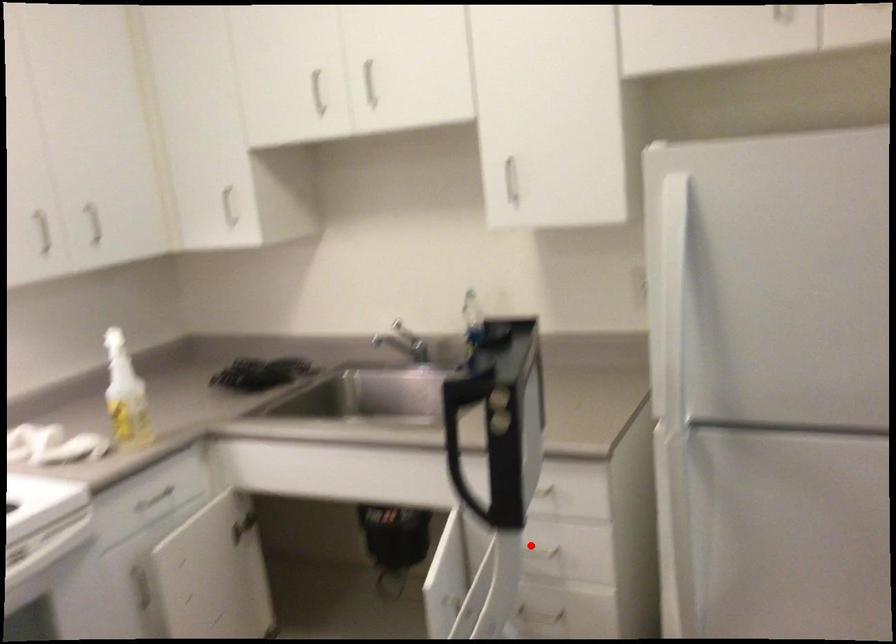
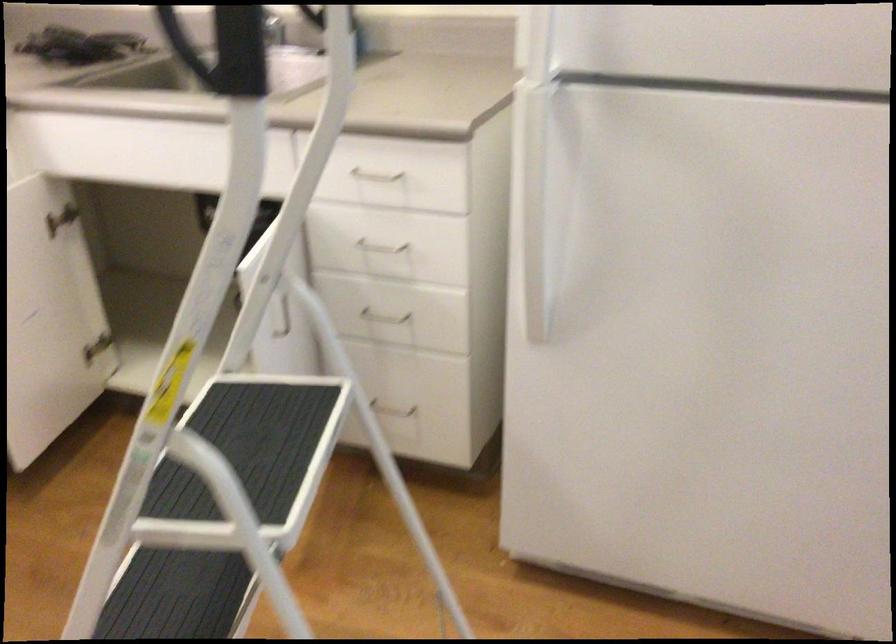
Question: A red point is marked in image1. In image2, is the corresponding 3D point closer to the camera or farther? Reply with the corresponding letter.

Choices:
 (A) The corresponding 3D point is closer.
 (B) The corresponding 3D point is farther.

Answer: (A)